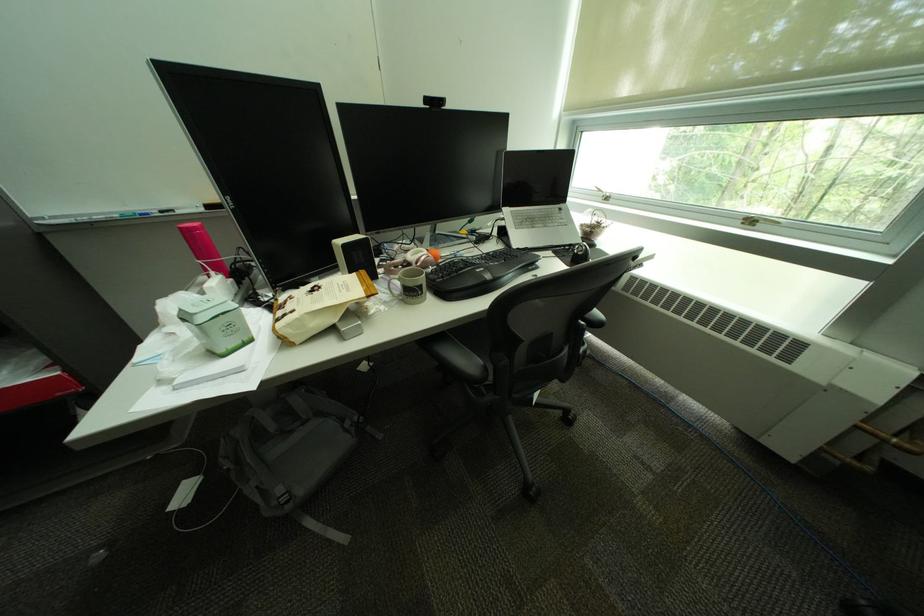
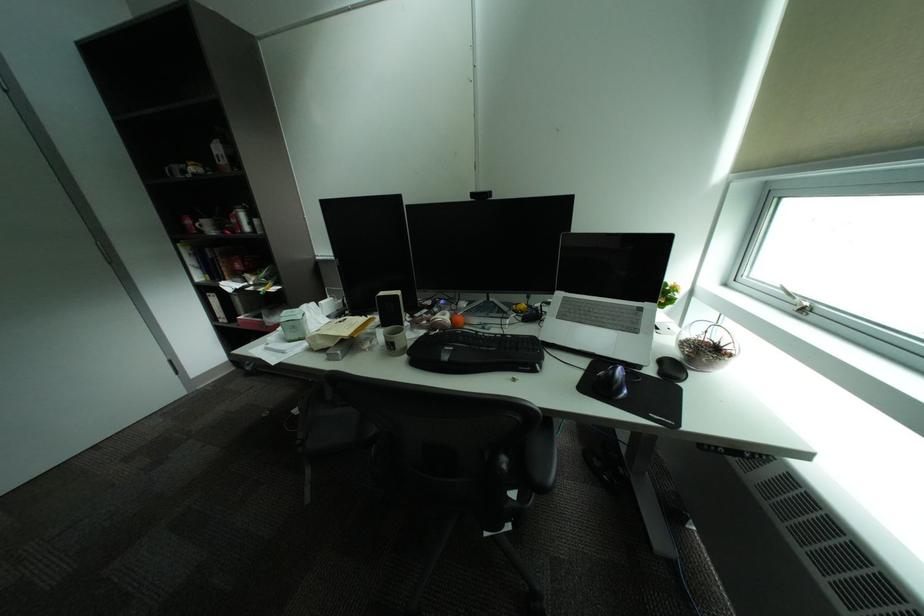
In the second image, find the point that corresponds to [499,254] in the first image.

(516, 336)